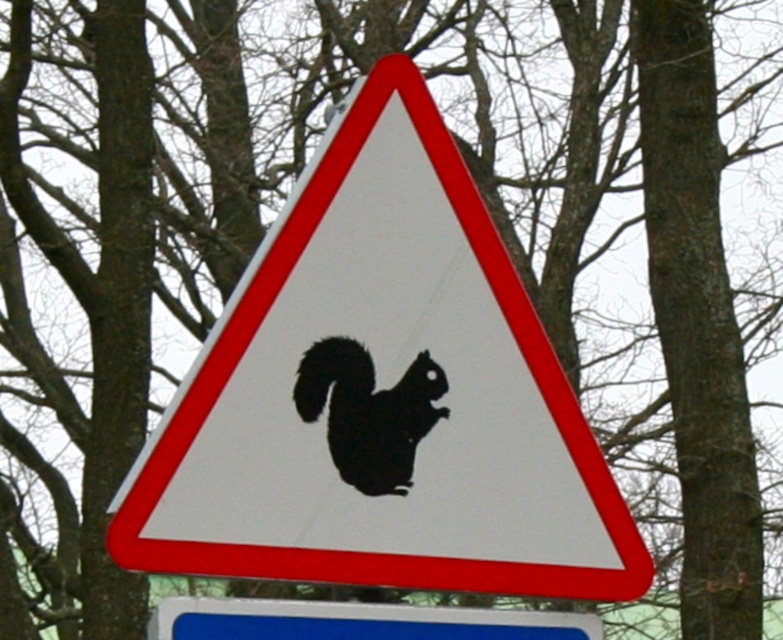
Does white plastic sign at center come behind black matte/silhouette squirrel at center?

No, white plastic sign at center is closer to the viewer.

Which is above, white plastic sign at center or black matte/silhouette squirrel at center?

black matte/silhouette squirrel at center is above.

Where is `white plastic sign at center`? The width and height of the screenshot is (783, 640). white plastic sign at center is located at coordinates (356, 621).